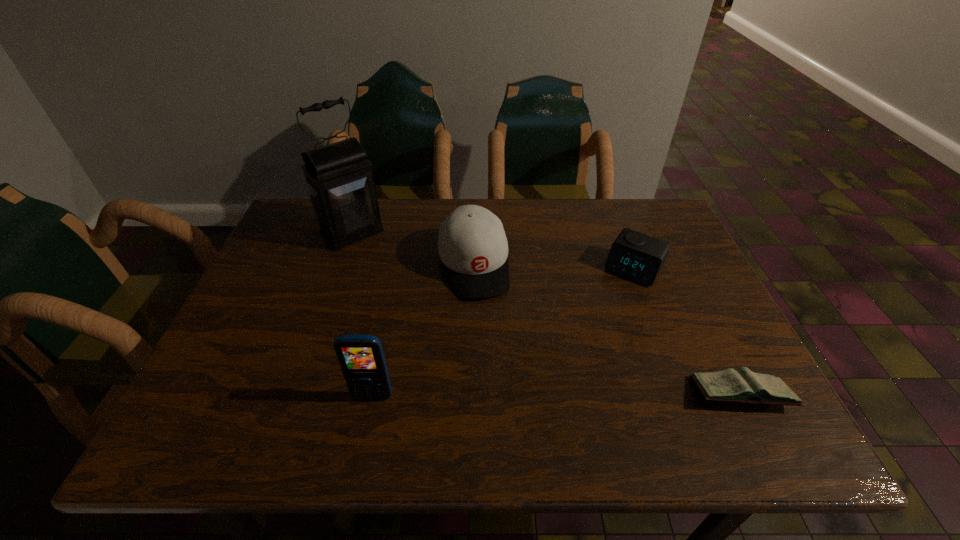
Locate an element on the screen. This screenshot has width=960, height=540. free space at the far left corner of the desktop is located at coordinates [305, 212].

I want to click on blank space at the far right corner of the desktop, so click(625, 217).

At what (x,y) coordinates should I click in order to perform the action: click on vacant point located between the alarm clock and the fourth object from right to left. Please return your answer as a coordinate pair (x, y). The height and width of the screenshot is (540, 960). Looking at the image, I should click on (503, 333).

In order to click on free area in between the third object from right to left and the fourth tallest object in this screenshot , I will do `click(553, 267)`.

This screenshot has width=960, height=540. In order to click on free point between the tallest object and the cellular telephone in this screenshot , I will do `click(363, 314)`.

The height and width of the screenshot is (540, 960). Find the location of `vacant region between the fourth tallest object and the shortest object`. vacant region between the fourth tallest object and the shortest object is located at coordinates (687, 332).

At what (x,y) coordinates should I click in order to perform the action: click on free space that is in between the cellular telephone and the third object from right to left. Please return your answer as a coordinate pair (x, y). Looking at the image, I should click on 423,331.

This screenshot has height=540, width=960. What are the coordinates of `vacant region between the tallest object and the third tallest object` in the screenshot? It's located at (413, 248).

Locate an element on the screen. This screenshot has width=960, height=540. free space between the lantern and the shortest object is located at coordinates (546, 313).

Image resolution: width=960 pixels, height=540 pixels. Find the location of `blank region between the fourth tallest object and the shortest object`. blank region between the fourth tallest object and the shortest object is located at coordinates (687, 332).